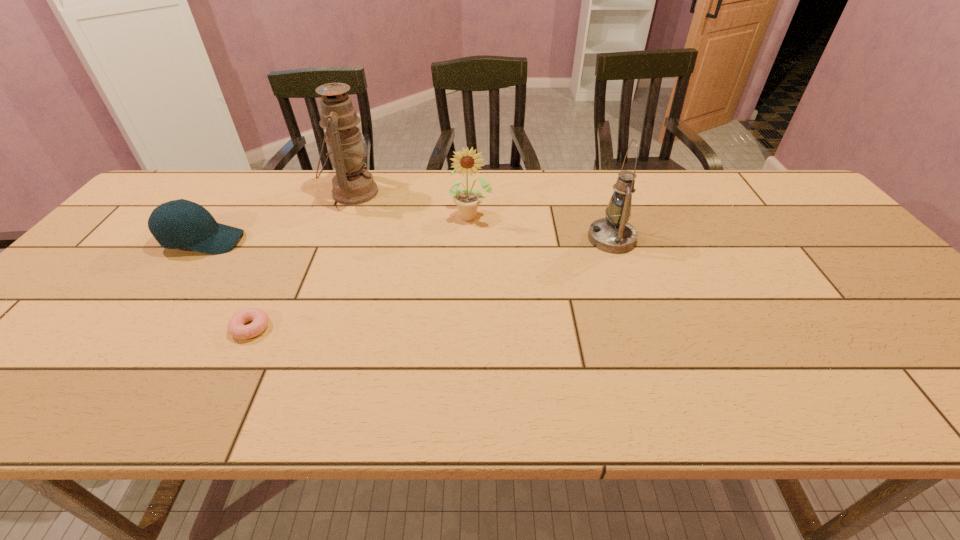
This screenshot has width=960, height=540. In the image, there is a desktop. Find the location of `vacant space at the right edge`. vacant space at the right edge is located at coordinates (903, 368).

Identify the location of unoccupied area between the shorter oil lamp and the leftmost object. [x=408, y=240].

Where is `vacant space that's between the left oil lamp and the doughnut`? This screenshot has width=960, height=540. vacant space that's between the left oil lamp and the doughnut is located at coordinates (301, 260).

Find the location of a particular element. vacant point located between the nearest object and the second tallest object is located at coordinates (431, 283).

Identify the location of vacant space that's between the rightmost object and the baseball cap. click(x=408, y=240).

The height and width of the screenshot is (540, 960). I want to click on free space that is in between the shortest object and the second shortest object, so click(228, 285).

You are a GUI agent. You are given a task and a screenshot of the screen. Output one action in this format:
    pyautogui.click(x=<x>, y=<y>)
    Task: Click on the vacant region between the fourth object from left to right and the farther oil lamp
    This screenshot has height=540, width=960.
    Given the screenshot: What is the action you would take?
    pyautogui.click(x=412, y=204)

Image resolution: width=960 pixels, height=540 pixels. Find the location of `free space that is in between the nearest object and the sunflower`. free space that is in between the nearest object and the sunflower is located at coordinates (361, 272).

Where is `vacant area that lies between the fourth tallest object and the shorter oil lamp`? The width and height of the screenshot is (960, 540). vacant area that lies between the fourth tallest object and the shorter oil lamp is located at coordinates (408, 240).

Find the location of a particular element. Image resolution: width=960 pixels, height=540 pixels. empty location between the fourth tallest object and the farther oil lamp is located at coordinates (278, 217).